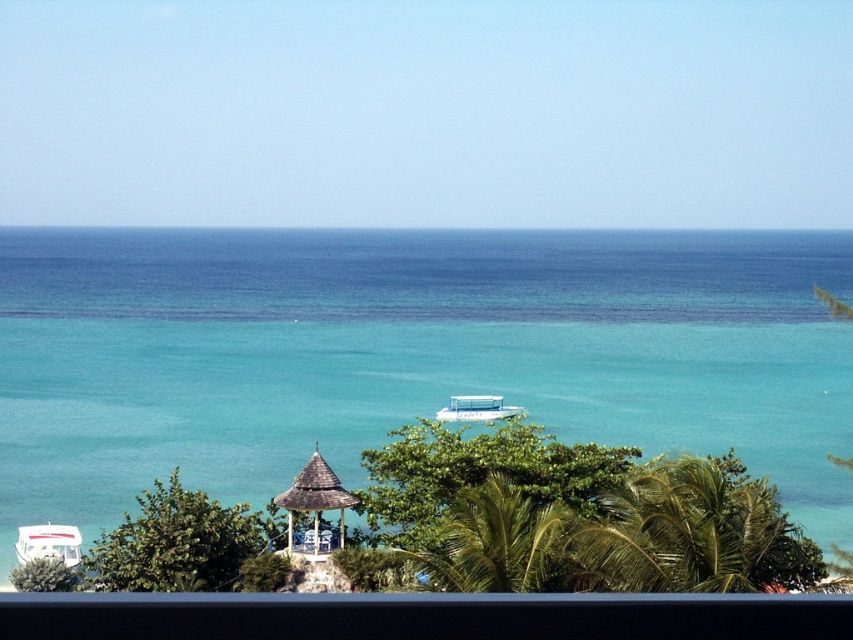
Which is behind, point (329, 470) or point (494, 412)?

The point (494, 412) is more distant.

Looking at this image, does wooden gazebo at center have a lesser width compared to white plastic boat at center?

Yes.

Locate an element on the screen. This screenshot has height=640, width=853. wooden gazebo at center is located at coordinates (315, 506).

Identify the location of wooden gazebo at center. (315, 506).

Is clear blue water at center further to the viewer compared to wooden gazebo at center?

Yes, clear blue water at center is further from the viewer.

Which is more to the left, clear blue water at center or wooden gazebo at center?

wooden gazebo at center is more to the left.

Where is `clear blue water at center`? clear blue water at center is located at coordinates (407, 355).

The image size is (853, 640). I want to click on clear blue water at center, so click(407, 355).

Which is above, white glossy boat at lower left or white plastic boat at center?

white plastic boat at center is above.

Is white glossy boat at lower left further to the viewer compared to white plastic boat at center?

No.

This screenshot has height=640, width=853. What do you see at coordinates (49, 544) in the screenshot?
I see `white glossy boat at lower left` at bounding box center [49, 544].

You are a GUI agent. You are given a task and a screenshot of the screen. Output one action in this format:
    pyautogui.click(x=<x>, y=<y>)
    Task: Click on the white glossy boat at lower left
    The width and height of the screenshot is (853, 640).
    Given the screenshot: What is the action you would take?
    pyautogui.click(x=49, y=544)